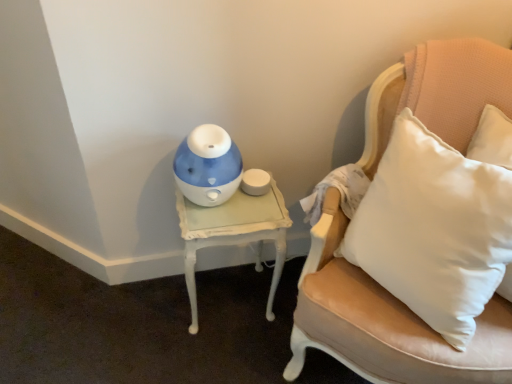
This screenshot has height=384, width=512. Describe the element at coordinates (234, 234) in the screenshot. I see `white painted wood table at left` at that location.

Find the location of a particular element. blue glossy humidifier at center is located at coordinates (208, 166).

Image resolution: width=512 pixels, height=384 pixels. Find the location of `white painted wood table at left`. white painted wood table at left is located at coordinates (234, 234).

Can blue glossy humidifier at center be found inside white painted wood table at left?

No.

From the image's perspective, which one is positioned lower, white painted wood table at left or blue glossy humidifier at center?

From the image's view, white painted wood table at left is below.

From the picture: From a real-world perspective, is white painted wood table at left positioned over blue glossy humidifier at center based on gravity?

No, from a real-world perspective, white painted wood table at left is not above blue glossy humidifier at center.

Is white painted wood table at left wider or thinner than leather cushion at right?

white painted wood table at left is thinner than leather cushion at right.

From the image's perspective, relative to leather cushion at right, is white painted wood table at left above or below?

Based on their image positions, white painted wood table at left is located beneath leather cushion at right.

Can you tell me how much white painted wood table at left and leather cushion at right differ in facing direction?

The angle between the facing direction of white painted wood table at left and the facing direction of leather cushion at right is 29.1 degrees.

From a real-world perspective, is white painted wood table at left under leather cushion at right?

Indeed, from a real-world perspective, white painted wood table at left is positioned beneath leather cushion at right.

Which object is closer to the camera taking this photo, leather cushion at right or blue glossy humidifier at center?

leather cushion at right is closer to the camera.

From a real-world perspective, is leather cushion at right on top of blue glossy humidifier at center?

Actually, leather cushion at right is physically below blue glossy humidifier at center in the real world.

Can you confirm if leather cushion at right is wider than blue glossy humidifier at center?

Yes, leather cushion at right is wider than blue glossy humidifier at center.

Is blue glossy humidifier at center facing towards white painted wood table at left?

No, blue glossy humidifier at center does not turn towards white painted wood table at left.

Would you say blue glossy humidifier at center is a long distance from white painted wood table at left?

That's not correct — blue glossy humidifier at center is a little close to white painted wood table at left.

Can you tell me how much blue glossy humidifier at center and white painted wood table at left differ in facing direction?

The angular difference between blue glossy humidifier at center and white painted wood table at left is 1.22 degrees.

Considering the relative positions of blue glossy humidifier at center and white painted wood table at left in the image provided, is blue glossy humidifier at center behind white painted wood table at left?

No, blue glossy humidifier at center is closer to the camera.

Which of these two, leather cushion at right or white painted wood table at left, is bigger?

With larger size is leather cushion at right.

From the image's perspective, which is below, leather cushion at right or white painted wood table at left?

white painted wood table at left.

Considering the relative positions of leather cushion at right and white painted wood table at left in the image provided, is leather cushion at right to the left or to the right of white painted wood table at left?

Clearly, leather cushion at right is on the right of white painted wood table at left in the image.

From a real-world perspective, is leather cushion at right physically located above or below white painted wood table at left?

leather cushion at right is situated higher than white painted wood table at left in the real world.

Which object is positioned more to the left, blue glossy humidifier at center or leather cushion at right?

Positioned to the left is blue glossy humidifier at center.

Is leather cushion at right at the back of blue glossy humidifier at center?

No.

Is leather cushion at right a part of blue glossy humidifier at center?

No, leather cushion at right is not inside blue glossy humidifier at center.

I want to click on toy lying above the white painted wood table at left (from the image's perspective), so click(x=208, y=166).

Locate an element on the screen. table located on the left of leather cushion at right is located at coordinates (234, 234).

Estimate the real-world distances between objects in this image. Which object is further from white painted wood table at left, blue glossy humidifier at center or leather cushion at right?

The object further to white painted wood table at left is leather cushion at right.

Estimate the real-world distances between objects in this image. Which object is closer to white painted wood table at left, leather cushion at right or blue glossy humidifier at center?

The object closer to white painted wood table at left is blue glossy humidifier at center.

Estimate the real-world distances between objects in this image. Which object is further from blue glossy humidifier at center, leather cushion at right or white painted wood table at left?

The object further to blue glossy humidifier at center is leather cushion at right.

Estimate the real-world distances between objects in this image. Which object is further from blue glossy humidifier at center, white painted wood table at left or leather cushion at right?

leather cushion at right.

Looking at the image, which one is located further to leather cushion at right, blue glossy humidifier at center or white painted wood table at left?

Among the two, blue glossy humidifier at center is located further to leather cushion at right.

When comparing their distances from leather cushion at right, does white painted wood table at left or blue glossy humidifier at center seem closer?

white painted wood table at left is closer to leather cushion at right.

Locate an element on the screen. This screenshot has width=512, height=384. table between blue glossy humidifier at center and leather cushion at right is located at coordinates (234, 234).